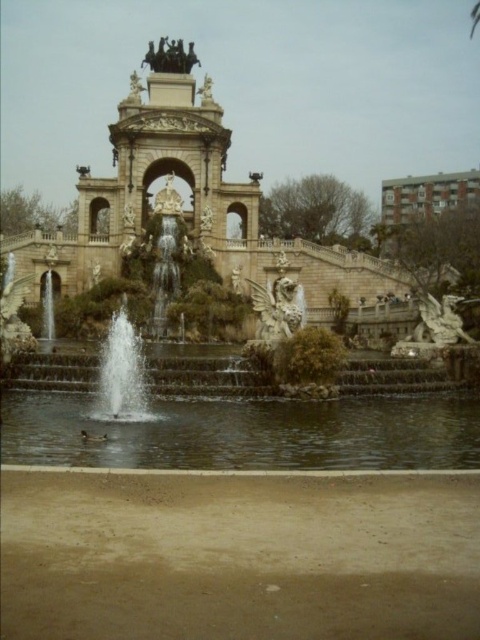
You are standing in the park and see the grand ornate fountain at center. There is a point marked at coordinates (219, 209). What is located at that point?

The stone fountain at center is located at point (219, 209).

You are standing at the base of the fountain and want to take a photo of the bronze statue at upper center and the white stone archway at center. Which object should you frame first in your camera to ensure both are in the shot?

You should frame the bronze statue at upper center first since it is to the left of the white stone archway at center, ensuring both are captured in the photo.